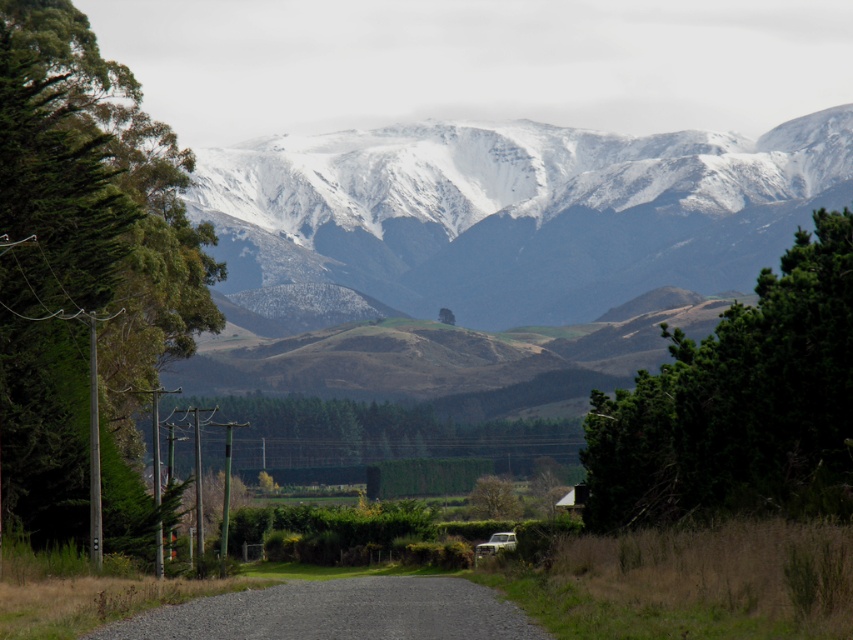
You are a hiker standing on the gravel road and looking towards the snowy rock mountain range at upper center and the green textured tree at right. Which object is higher in the image?

The snowy rock mountain range at upper center is higher than the green textured tree at right because it is positioned above it in the image.

You are standing at the starting point of the gravel road and want to reach the small house nestled among the trees. The green leafy tree at left is blocking your view of the house. Can you estimate how far you need to walk along the road to get a clear view of the house?

The green leafy tree at left is 252.84 feet away from viewer. To get a clear view of the house, you need to walk past this tree, so you should walk approximately 252.84 feet along the road.